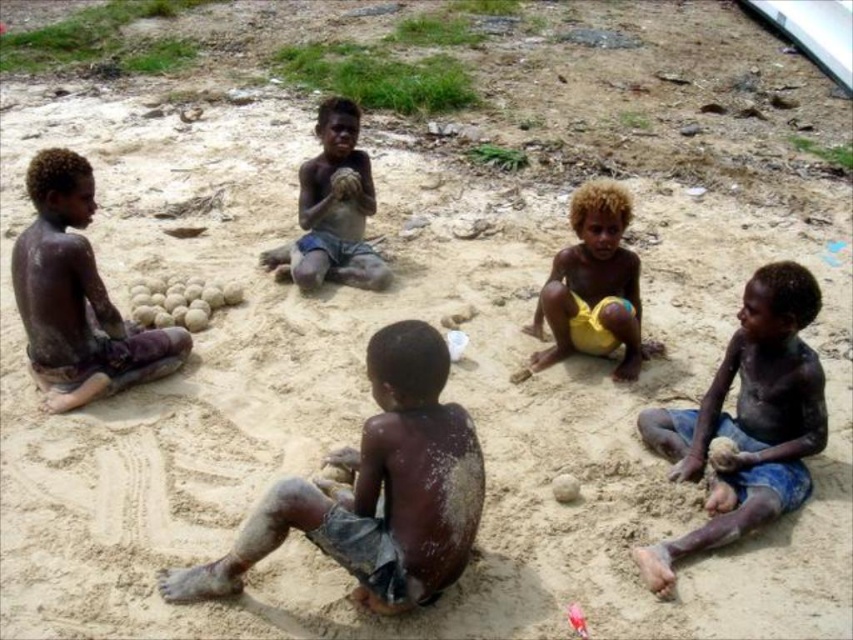
You are a photographer trying to capture a group photo of the children. Since you want to ensure that the brown skin boy at center and the dark skin boy at lower right are both visible in the frame, which child should you position closer to the camera to avoid being blocked by the other?

The brown skin boy at center is smaller than the dark skin boy at lower right, so you should position the brown skin boy at center closer to the camera to ensure he isn